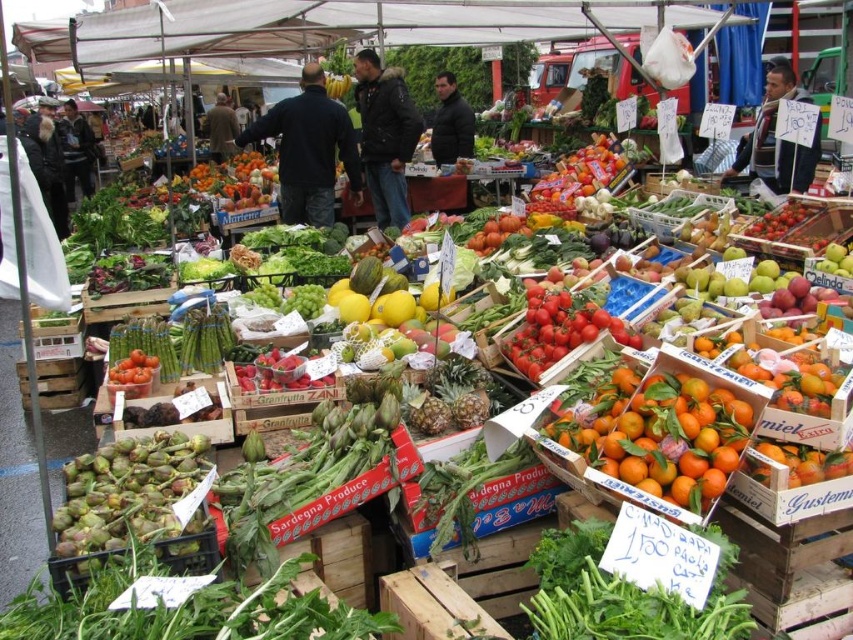
Question: Does yellow matte melon at center have a greater width compared to red matte tomatoes at center?

Choices:
 (A) yes
 (B) no

Answer: (A)

Question: Which of the following is the farthest from the observer?

Choices:
 (A) orange matte at center
 (B) green matte artichoke at lower left

Answer: (B)

Question: Estimate the real-world distances between objects in this image. Which object is closer to the ripe red tomato at center?

Choices:
 (A) orange matte at center
 (B) green leafy at center
 (C) dark blue jacket at center
 (D) green matte artichoke at lower left

Answer: (A)

Question: Does orange matte at center appear on the right side of yellow matte melon at center?

Choices:
 (A) yes
 (B) no

Answer: (A)

Question: Can you confirm if orange matte at center is thinner than green leafy at center?

Choices:
 (A) yes
 (B) no

Answer: (B)

Question: Which point appears closest to the camera in this image?

Choices:
 (A) (173, 557)
 (B) (364, 172)
 (C) (347, 284)

Answer: (A)